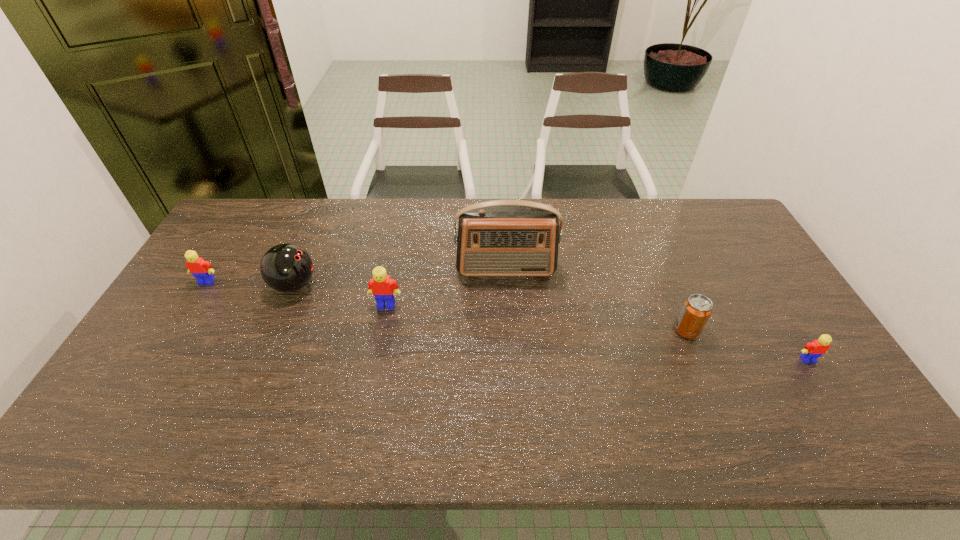
Locate an element on the screen. blank region between the fourth object from right to left and the shortest object is located at coordinates (597, 332).

Identify the location of free area in between the leftmost object and the fifth object from left to right. The height and width of the screenshot is (540, 960). (446, 306).

What are the coordinates of `empty location between the bowling ball and the tallest Lego` in the screenshot? It's located at (340, 295).

Image resolution: width=960 pixels, height=540 pixels. I want to click on blank region between the fourth object from left to right and the rightmost Lego, so click(657, 314).

Image resolution: width=960 pixels, height=540 pixels. Find the location of `free space between the second object from left to right and the soda can`. free space between the second object from left to right and the soda can is located at coordinates (491, 308).

Identify which object is located as the fifth nearest to the fifth object from right to left. Please provide its 2D coordinates. Your answer should be formatted as a tuple, i.e. [(x, y)], where the tuple contains the x and y coordinates of a point satisfying the conditions above.

[(812, 351)]

Identify which object is located as the second nearest to the second object from right to left. Please provide its 2D coordinates. Your answer should be formatted as a tuple, i.e. [(x, y)], where the tuple contains the x and y coordinates of a point satisfying the conditions above.

[(509, 237)]

Identify which Lego is the nearest to the farthest Lego. Please provide its 2D coordinates. Your answer should be formatted as a tuple, i.e. [(x, y)], where the tuple contains the x and y coordinates of a point satisfying the conditions above.

[(381, 286)]

Select which Lego is the third closest to the second object from left to right. Please provide its 2D coordinates. Your answer should be formatted as a tuple, i.e. [(x, y)], where the tuple contains the x and y coordinates of a point satisfying the conditions above.

[(812, 351)]

Locate an element on the screen. Image resolution: width=960 pixels, height=540 pixels. blank area in the image that satisfies the following two spatial constraints: 1. on the surface of the second object from right to left near the finger holes; 2. on the left side of the bowling ball is located at coordinates (276, 330).